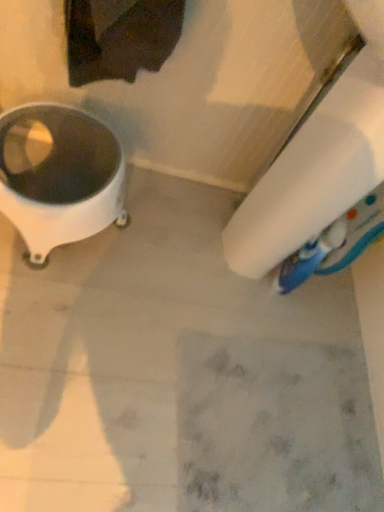
Image resolution: width=384 pixels, height=512 pixels. Describe the element at coordinates (59, 176) in the screenshot. I see `white glossy waste container at left` at that location.

What is the approximate width of white glossy waste container at left?

14.59 inches.

Where is `white glossy waste container at left`? white glossy waste container at left is located at coordinates pos(59,176).

Locate an element on the screen. white glossy toilet paper at lower right is located at coordinates (318, 161).

Measure the distance between white glossy toilet paper at lower right and camera.

19.83 inches.

This screenshot has height=512, width=384. What do you see at coordinates (318, 161) in the screenshot?
I see `white glossy toilet paper at lower right` at bounding box center [318, 161].

Identify the location of white glossy waste container at left. Image resolution: width=384 pixels, height=512 pixels. (59, 176).

In the image, is white glossy waste container at left on the left side or the right side of white glossy toilet paper at lower right?

Clearly, white glossy waste container at left is on the left of white glossy toilet paper at lower right in the image.

Considering their positions, is white glossy waste container at left located in front of or behind white glossy toilet paper at lower right?

white glossy waste container at left is behind white glossy toilet paper at lower right.

Is point (0, 117) positioned in front of point (310, 122)?

No, (0, 117) is further to viewer.

From the image's perspective, would you say white glossy waste container at left is positioned over white glossy toilet paper at lower right?

No, from the image's perspective, white glossy waste container at left is not on top of white glossy toilet paper at lower right.

From a real-world perspective, between white glossy waste container at left and white glossy toilet paper at lower right, who is vertically lower?

From a 3D spatial view, white glossy waste container at left is below.

In the scene shown: Does white glossy waste container at left have a greater width compared to white glossy toilet paper at lower right?

No, white glossy waste container at left is not wider than white glossy toilet paper at lower right.

Considering the sizes of white glossy waste container at left and white glossy toilet paper at lower right in the image, is white glossy waste container at left taller or shorter than white glossy toilet paper at lower right?

In the image, white glossy waste container at left appears to be shorter than white glossy toilet paper at lower right.

Based on their sizes in the image, would you say white glossy waste container at left is bigger or smaller than white glossy toilet paper at lower right?

Clearly, white glossy waste container at left is smaller in size than white glossy toilet paper at lower right.

Is white glossy waste container at left surrounding white glossy toilet paper at lower right?

Definitely not — white glossy toilet paper at lower right is not inside white glossy waste container at left.

Is white glossy waste container at left not near white glossy toilet paper at lower right?

That's not correct — white glossy waste container at left is a little close to white glossy toilet paper at lower right.

Is white glossy waste container at left oriented away from white glossy toilet paper at lower right?

No, white glossy waste container at left's orientation is not away from white glossy toilet paper at lower right.

Can you tell me how much white glossy waste container at left and white glossy toilet paper at lower right differ in facing direction?

They differ by 3.14 degrees in their facing directions.

Looking at this image, how much distance is there between white glossy waste container at left and white glossy toilet paper at lower right?

The distance of white glossy waste container at left from white glossy toilet paper at lower right is 17.27 inches.

Identify the location of waste container lying below the white glossy toilet paper at lower right (from the image's perspective). Image resolution: width=384 pixels, height=512 pixels. (59, 176).

Considering the positions of objects white glossy toilet paper at lower right and white glossy waste container at left in the image provided, who is more to the right, white glossy toilet paper at lower right or white glossy waste container at left?

Positioned to the right is white glossy toilet paper at lower right.

Which object is more forward, white glossy toilet paper at lower right or white glossy waste container at left?

white glossy toilet paper at lower right is in front.

Is point (261, 244) farther from viewer compared to point (106, 199)?

Yes, point (261, 244) is farther from viewer.

From the image's perspective, between white glossy toilet paper at lower right and white glossy waste container at left, who is located below?

white glossy waste container at left appears lower in the image.

From a real-world perspective, does white glossy toilet paper at lower right stand above white glossy waste container at left?

Yes.

Looking at this image, considering the relative sizes of white glossy toilet paper at lower right and white glossy waste container at left in the image provided, is white glossy toilet paper at lower right wider than white glossy waste container at left?

Yes.

From their relative heights in the image, would you say white glossy toilet paper at lower right is taller or shorter than white glossy waste container at left?

Considering their sizes, white glossy toilet paper at lower right has more height than white glossy waste container at left.

Which of these two, white glossy toilet paper at lower right or white glossy waste container at left, is bigger?

With larger size is white glossy toilet paper at lower right.

Looking at this image, is white glossy toilet paper at lower right not within white glossy waste container at left?

Yes, white glossy toilet paper at lower right is not within white glossy waste container at left.

Are white glossy toilet paper at lower right and white glossy waste container at left far apart?

That's not correct — white glossy toilet paper at lower right is a little close to white glossy waste container at left.

Is white glossy toilet paper at lower right facing towards white glossy waste container at left?

No, white glossy toilet paper at lower right is not turned towards white glossy waste container at left.

What's the angular difference between white glossy toilet paper at lower right and white glossy waste container at left's facing directions?

The angular difference between white glossy toilet paper at lower right and white glossy waste container at left is 3.14 degrees.

Consider the image. How much distance is there between white glossy toilet paper at lower right and white glossy waste container at left?

white glossy toilet paper at lower right is 17.27 inches away from white glossy waste container at left.

This screenshot has width=384, height=512. In the image, there is a white glossy toilet paper at lower right. Identify the location of waste container below it (from a real-world perspective). pos(59,176).

Locate an element on the screen. This screenshot has height=512, width=384. waste container behind the white glossy toilet paper at lower right is located at coordinates (59, 176).

Identify the location of waste container below the white glossy toilet paper at lower right (from the image's perspective). The height and width of the screenshot is (512, 384). (59, 176).